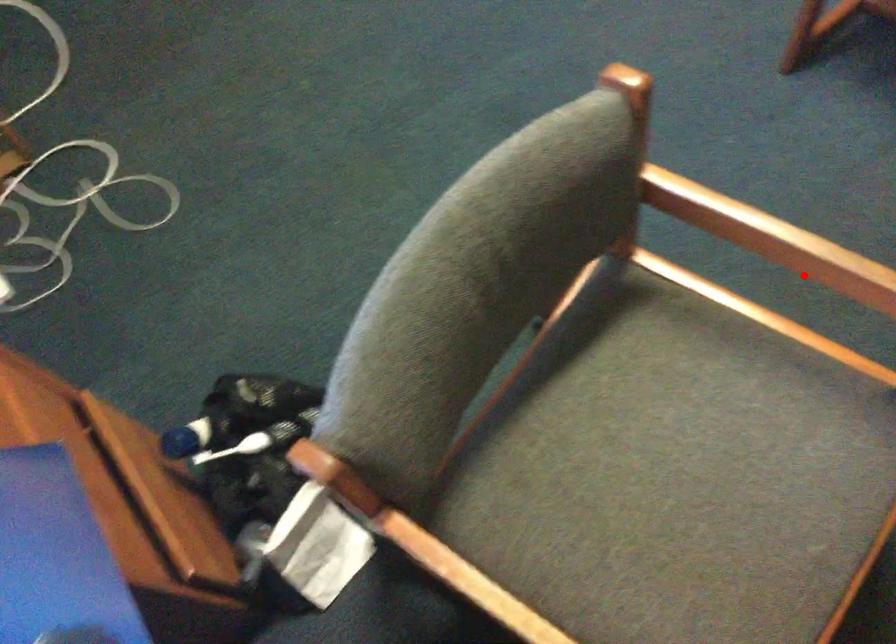
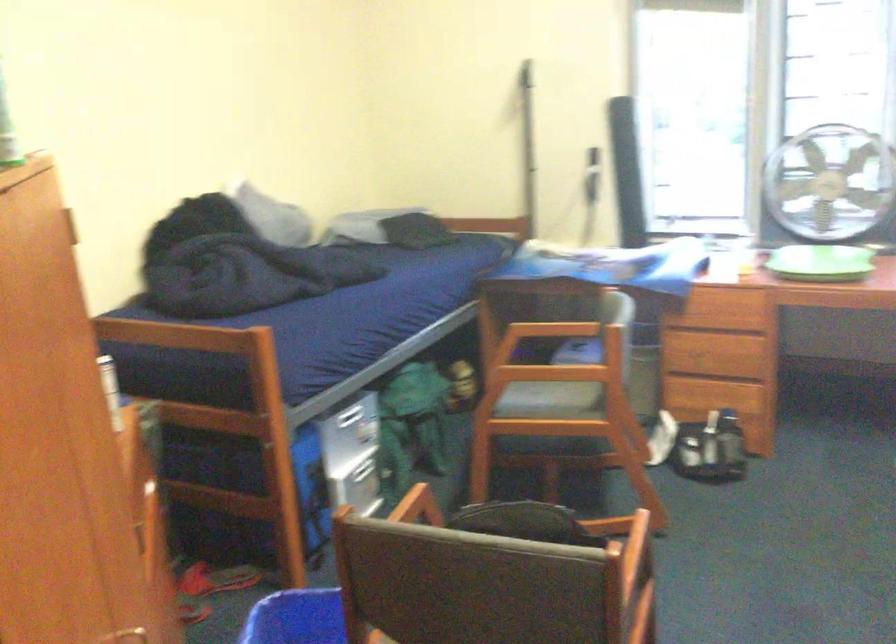
In the second image, find the point that corresponds to the highlighted location in the first image.

(540, 375)